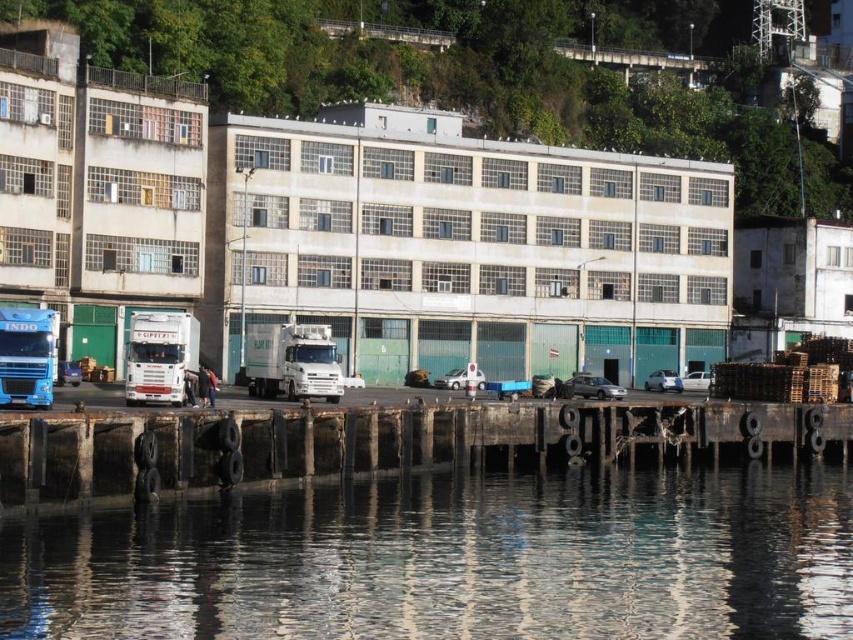
Who is more forward, (76, 465) or (274, 339)?

Point (76, 465)

Does rusty wooden dock at lower center appear under white glossy truck at center?

Yes, rusty wooden dock at lower center is below white glossy truck at center.

Who is more forward, (160,419) or (335,355)?

Point (160,419)

Where is `rusty wooden dock at lower center`? This screenshot has height=640, width=853. rusty wooden dock at lower center is located at coordinates (386, 442).

Is white glossy truck at center taller than blue metallic truck at left?

Incorrect, white glossy truck at center's height is not larger of blue metallic truck at left's.

Between white glossy truck at center and blue metallic truck at left, which one appears on the right side from the viewer's perspective?

From the viewer's perspective, white glossy truck at center appears more on the right side.

Does point (254, 364) lie in front of point (0, 403)?

No, it is behind (0, 403).

What are the coordinates of `white glossy truck at center` in the screenshot? It's located at (292, 362).

Is transparent water at lower center in front of white glossy truck at center?

Yes, it is.

Can you confirm if transparent water at lower center is wider than white glossy truck at center?

Correct, the width of transparent water at lower center exceeds that of white glossy truck at center.

Which is in front, point (199, 630) or point (305, 333)?

Point (199, 630) is more forward.

At what (x,y) coordinates should I click in order to perform the action: click on transparent water at lower center. Please return your answer as a coordinate pair (x, y). The height and width of the screenshot is (640, 853). Looking at the image, I should click on (450, 560).